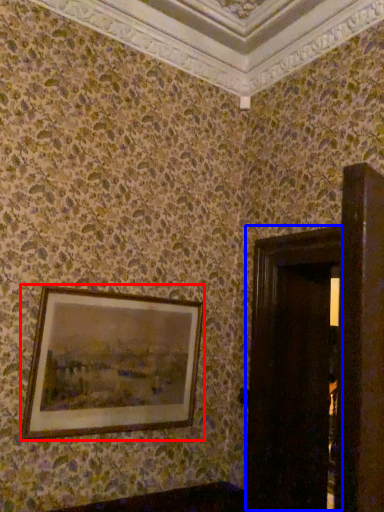
Question: Which of the following is the closest to the observer, picture frame (highlighted by a red box) or door (highlighted by a blue box)?

Choices:
 (A) picture frame
 (B) door

Answer: (B)